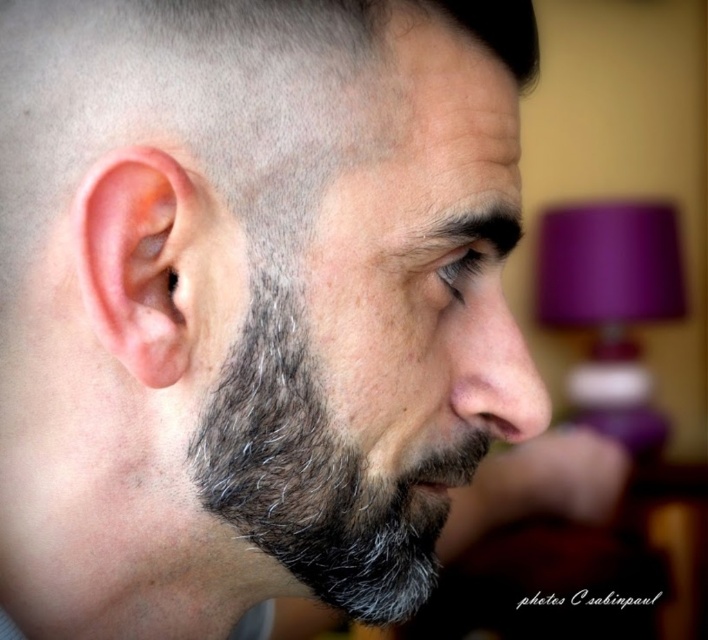
Which of these two, gray fuzzy beard at center or pink flesh/soft tissue ear at left, stands shorter?

Standing shorter between the two is pink flesh/soft tissue ear at left.

Where is `gray fuzzy beard at center`? The height and width of the screenshot is (640, 708). gray fuzzy beard at center is located at coordinates (316, 472).

Which is in front, point (389, 499) or point (101, 168)?

Point (101, 168)

The width and height of the screenshot is (708, 640). Find the location of `gray fuzzy beard at center`. gray fuzzy beard at center is located at coordinates (316, 472).